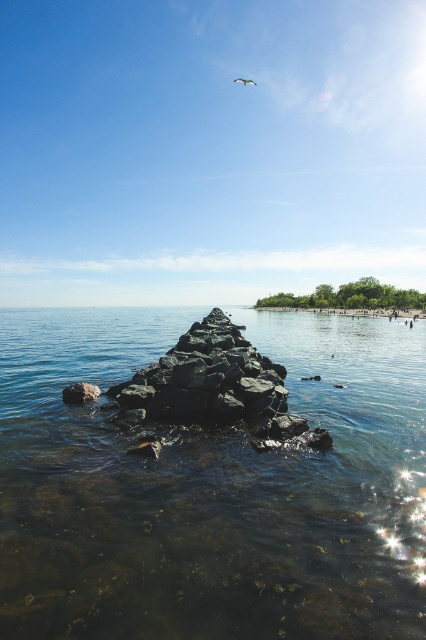
You are a kayaker planning to paddle through the area shown in the image. You need to navigate between the clear water at center and the gray rough rock at lower left. Which path should you choose to ensure a smoother journey?

You should choose the clear water at center because its width is larger than the gray rough rock at lower left, providing a wider and smoother path for your kayak.

You are standing at the center of the image and want to walk to the gray rough rock at lower left. Which direction should you move relative to your current position?

You should move to the lower left direction to reach the gray rough rock at lower left since its 2D location is at point (80, 392).

You are a photographer trying to capture the white feathered bird at upper center and the clear water at center in the same frame. Based on their positions, which object is located to the right side of the other?

The white feathered bird at upper center is positioned to the right of the clear water at center.